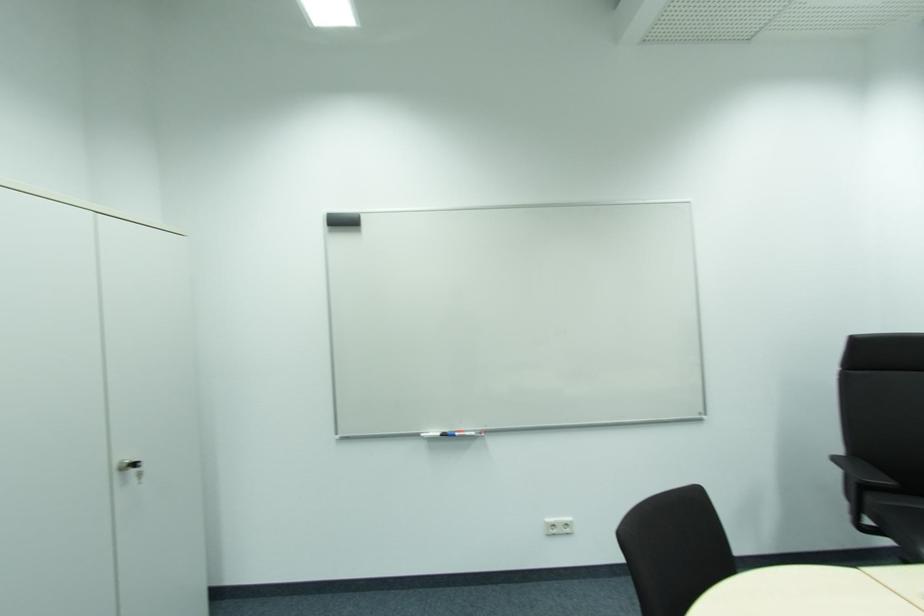
Find where to wip the black whiteboard eraser. Please return your answer as a coordinate pair (x, y).

(343, 219)